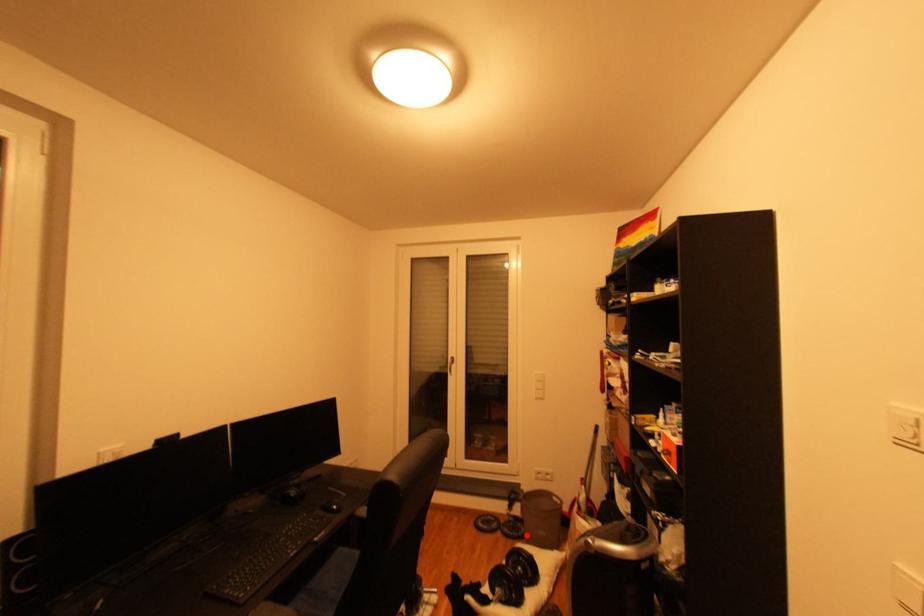
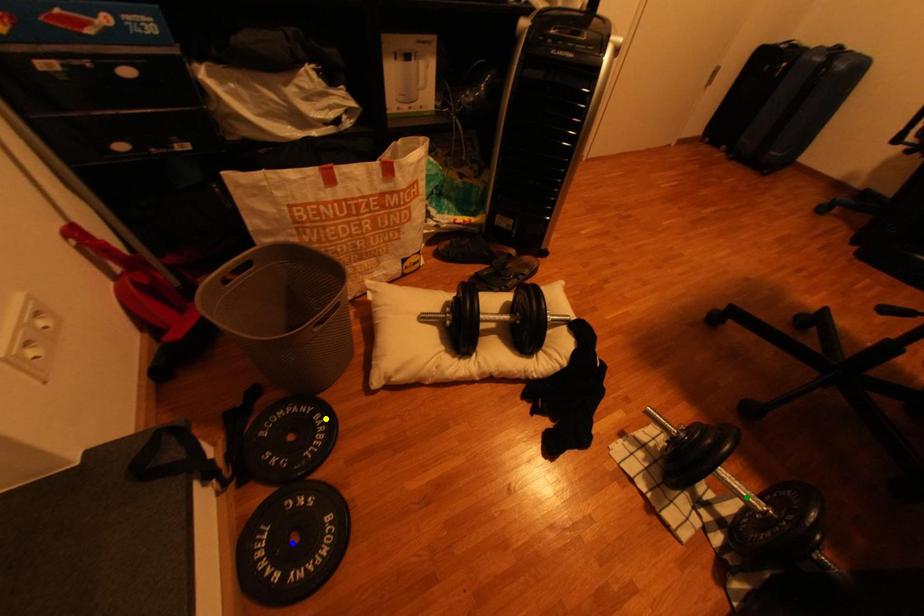
Question: I am providing you with two images of the same scene from different viewpoints. A red point is marked on the first image. You are given multiple points on the second image. In image 2, which mark is for the same physical point as the one in image 1?

Choices:
 (A) blue point
 (B) yellow point
 (C) green point

Answer: (B)